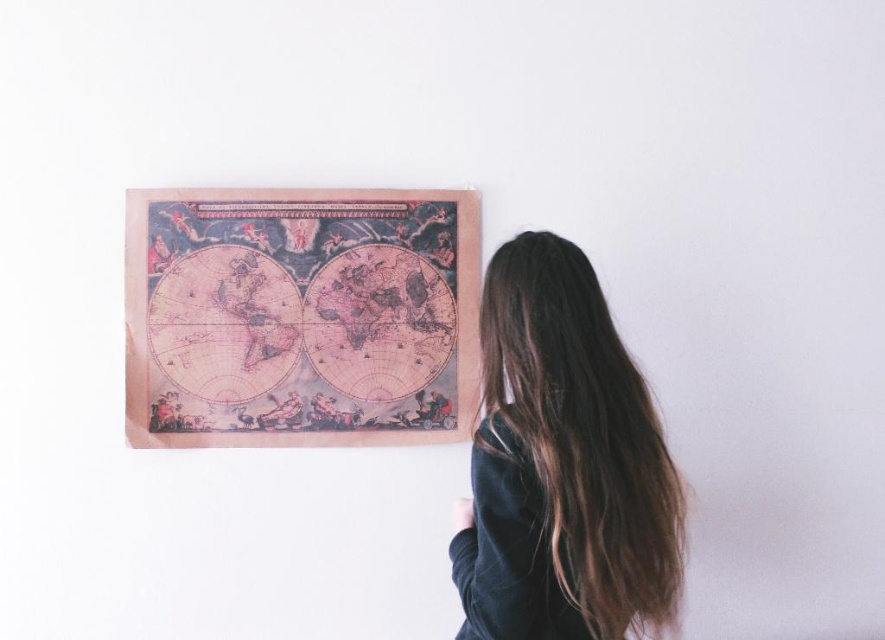
Between vintage paper map at center and dark brown hair at upper right, which one is positioned higher?

vintage paper map at center is above.

Does point (271, 396) come behind point (578, 381)?

Yes, it is behind point (578, 381).

This screenshot has width=885, height=640. I want to click on vintage paper map at center, so click(x=299, y=316).